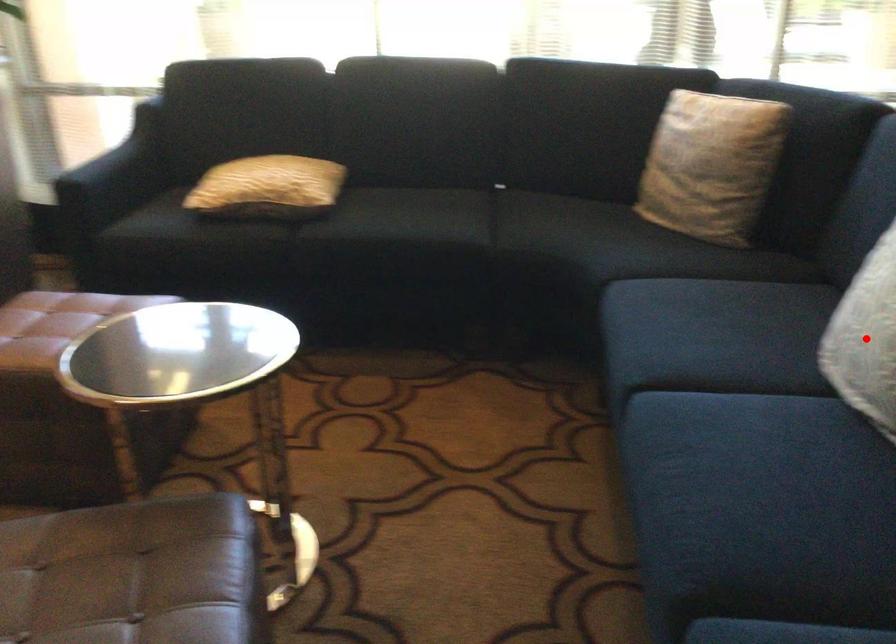
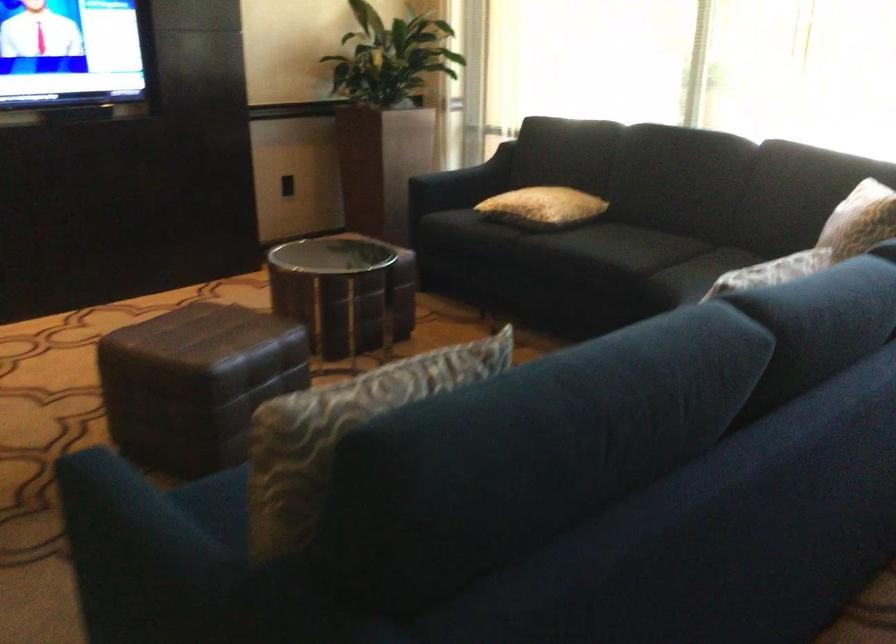
Question: I am providing you with two images of the same scene from different viewpoints. A red point is marked on the first image. At the location where the point appears in image 1, is it still visible in image 2?

Choices:
 (A) Yes
 (B) No

Answer: (B)